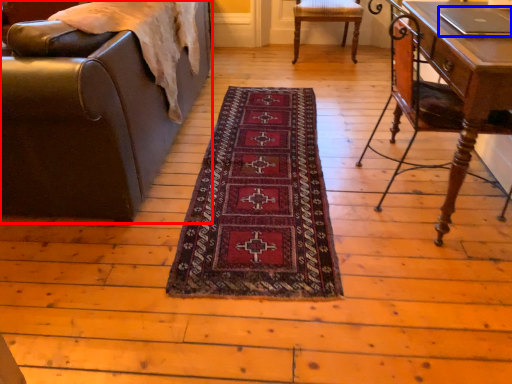
Question: Which object is closer to the camera taking this photo, chair (highlighted by a red box) or laptop (highlighted by a blue box)?

Choices:
 (A) chair
 (B) laptop

Answer: (A)